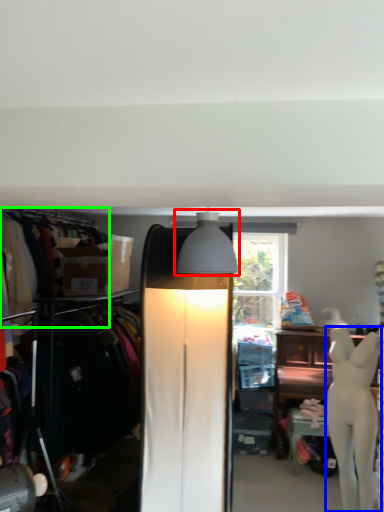
Question: Based on their relative distances, which object is nearer to lamp (highlighted by a red box)? Choose from mannequin (highlighted by a blue box) and clothing (highlighted by a green box).

Choices:
 (A) mannequin
 (B) clothing

Answer: (B)